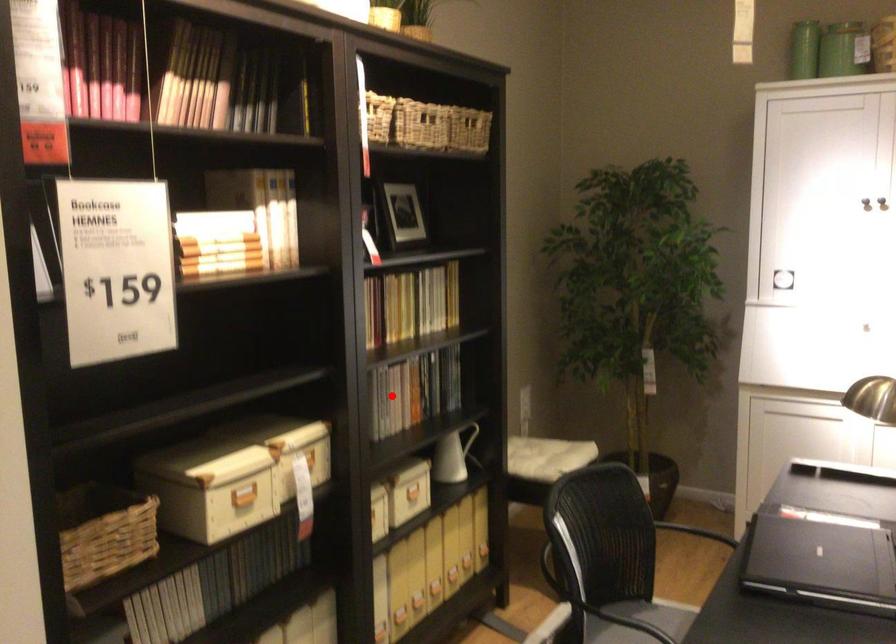
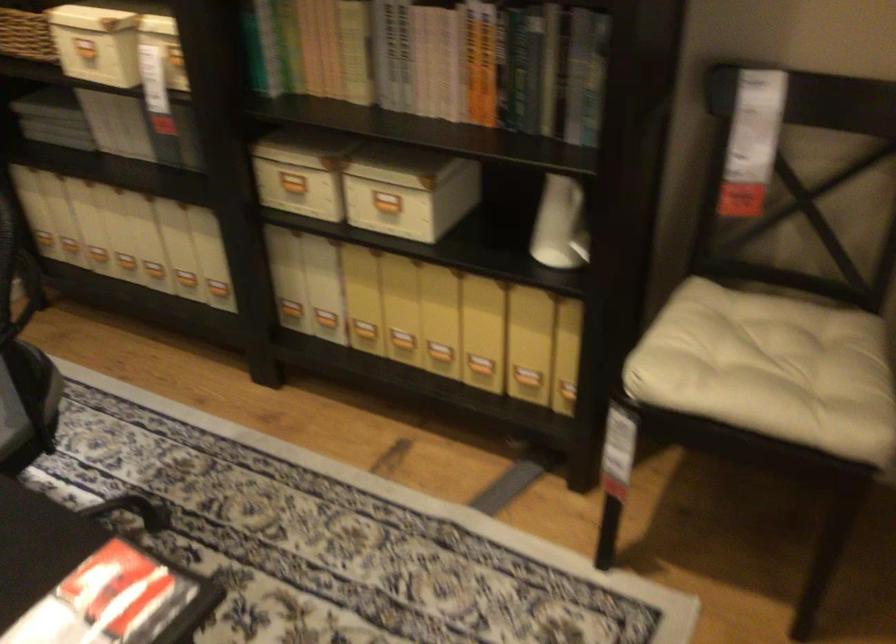
Find the pixel in the second image that matches the highlighted location in the first image.

(483, 62)